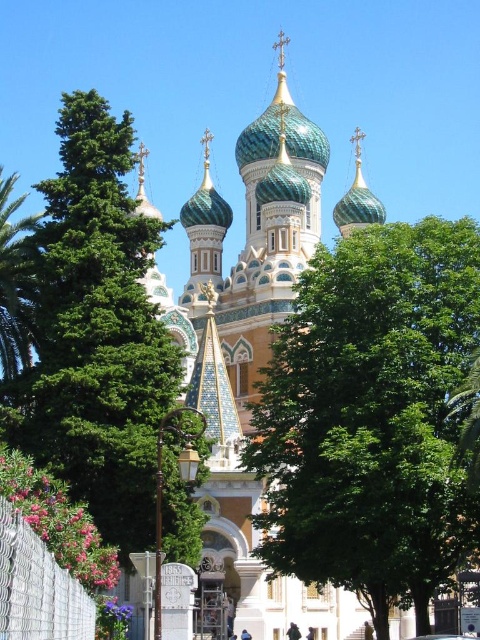
Does green leafy tree at center have a greater width compared to green leafy tree at left?

Indeed, green leafy tree at center has a greater width compared to green leafy tree at left.

From the picture: Is green leafy tree at center smaller than green leafy tree at left?

Actually, green leafy tree at center might be larger than green leafy tree at left.

You are a GUI agent. You are given a task and a screenshot of the screen. Output one action in this format:
    pyautogui.click(x=<x>, y=<y>)
    Task: Click on the green leafy tree at center
    
    Given the screenshot: What is the action you would take?
    pyautogui.click(x=372, y=417)